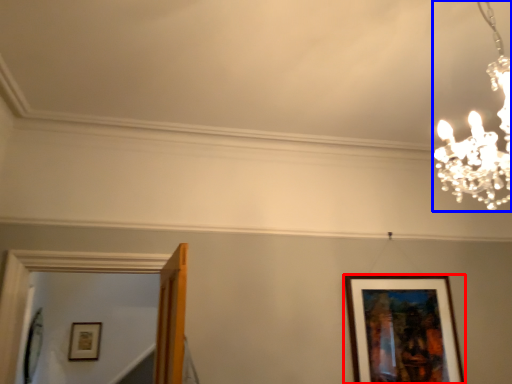
Question: Which object appears closest to the camera in this image, picture frame (highlighted by a red box) or lamp (highlighted by a blue box)?

Choices:
 (A) picture frame
 (B) lamp

Answer: (B)